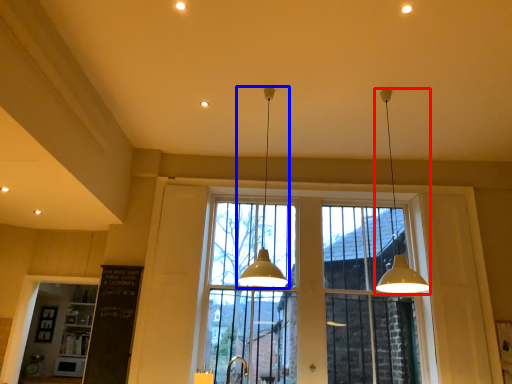
Question: Which of the following is the farthest to the observer, lamp (highlighted by a red box) or lamp (highlighted by a blue box)?

Choices:
 (A) lamp
 (B) lamp

Answer: (B)